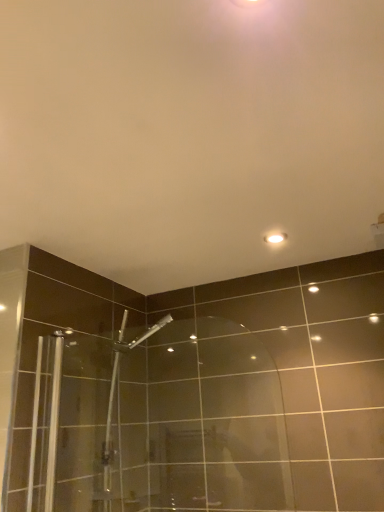
Question: Considering the positions of white glossy light fixture at upper center and transparent glass shower door at center in the image, is white glossy light fixture at upper center taller or shorter than transparent glass shower door at center?

Choices:
 (A) short
 (B) tall

Answer: (A)

Question: Does point (276, 241) appear closer or farther from the camera than point (137, 409)?

Choices:
 (A) closer
 (B) farther

Answer: (A)

Question: In the image, is white glossy light fixture at upper center on the left side or the right side of transparent glass shower door at center?

Choices:
 (A) right
 (B) left

Answer: (A)

Question: From a real-world perspective, is transparent glass shower door at center physically located above or below white glossy light fixture at upper center?

Choices:
 (A) above
 (B) below

Answer: (B)

Question: Considering their positions, is transparent glass shower door at center located in front of or behind white glossy light fixture at upper center?

Choices:
 (A) behind
 (B) front

Answer: (B)

Question: Does point (33, 394) appear closer or farther from the camera than point (271, 237)?

Choices:
 (A) farther
 (B) closer

Answer: (B)

Question: From the image's perspective, is transparent glass shower door at center located above or below white glossy light fixture at upper center?

Choices:
 (A) below
 (B) above

Answer: (A)